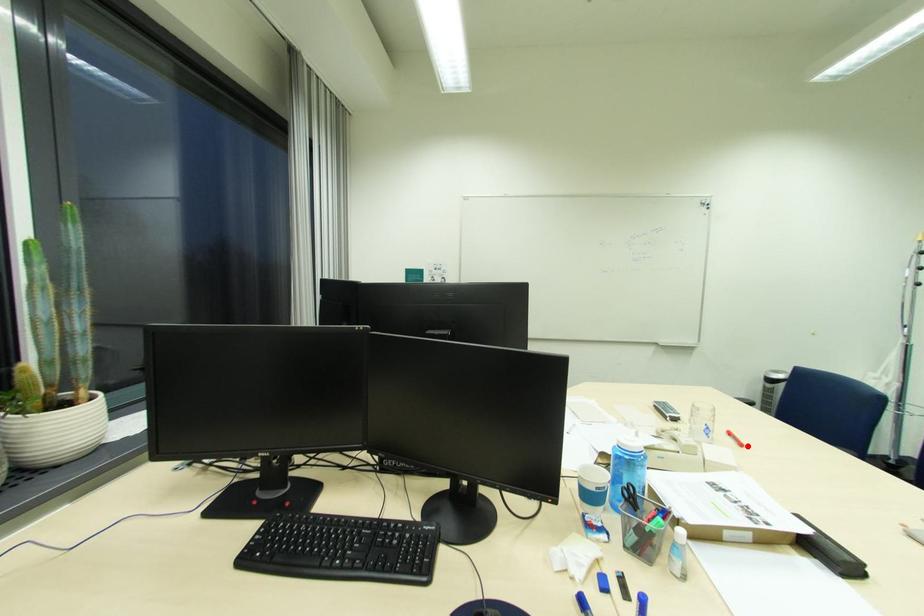
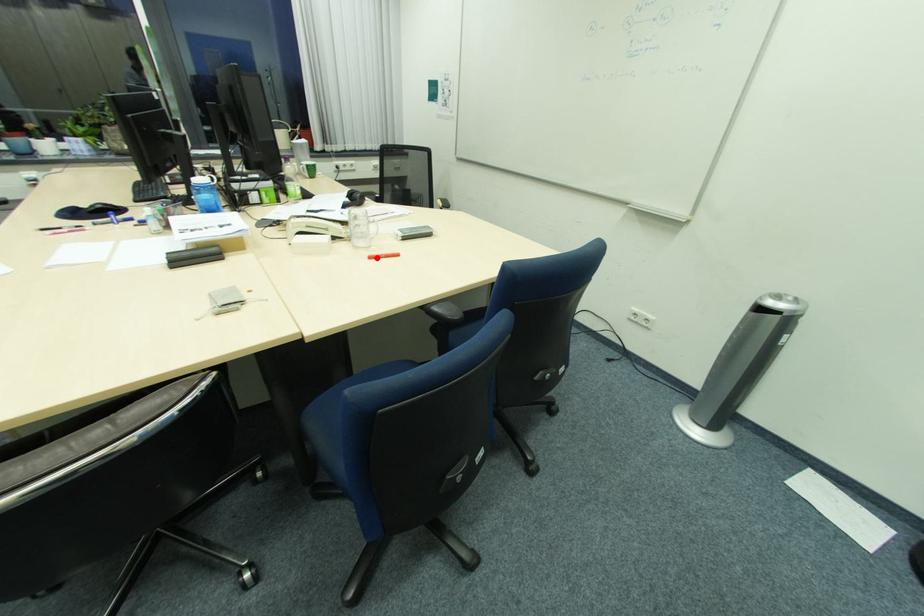
I am providing you with two images of the same scene from different viewpoints. A red point is marked on the first image and another point is marked on the second image. Are the points marked in image1 and image2 representing the same 3D position?

Yes